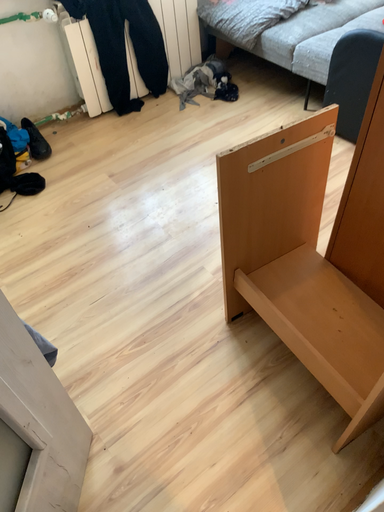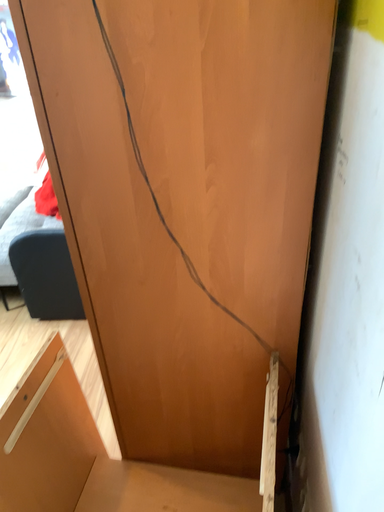
Question: Which way did the camera rotate in the video?

Choices:
 (A) rotated upward
 (B) rotated downward

Answer: (A)